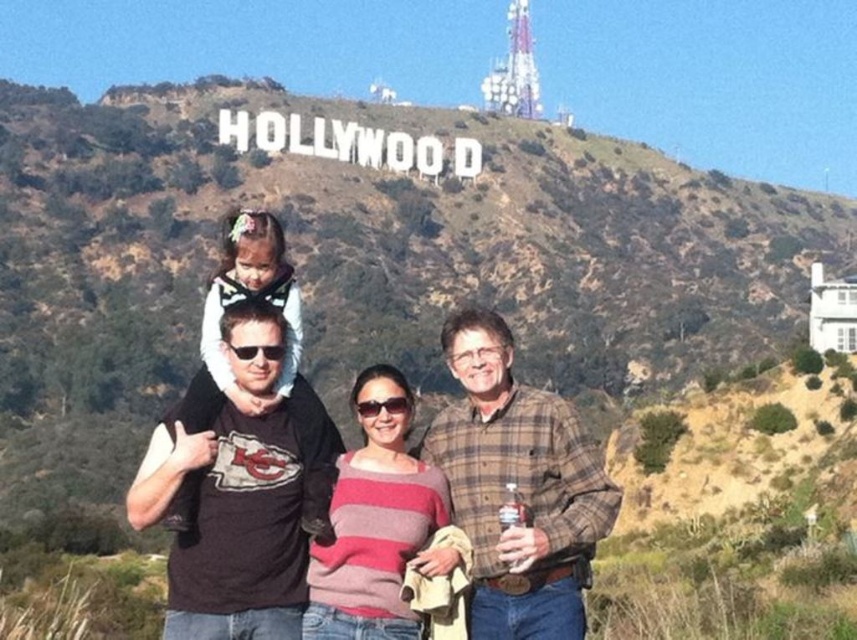
You are a photographer standing in front of the Hollywood sign. You notice two people wearing a plaid flannel shirt at center and a pink striped sweater at center. You want to take a photo that includes both of them in the frame. Given that your camera has a maximum focus range of 4 meters between subjects, will both subjects be in focus?

The plaid flannel shirt at center and pink striped sweater at center are 3.94 meters apart from each other, which is within the camera maximum focus range of 4 meters. Therefore, both subjects will be in focus.